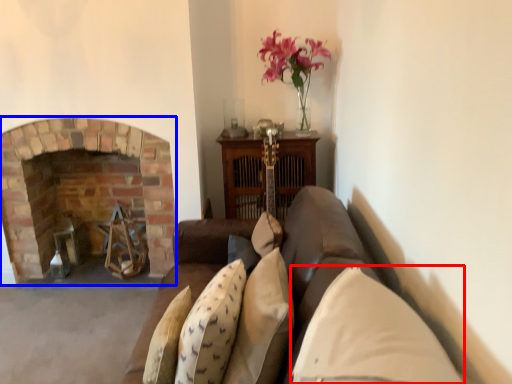
Question: Among these objects, which one is nearest to the camera, pillow (highlighted by a red box) or fireplace (highlighted by a blue box)?

Choices:
 (A) pillow
 (B) fireplace

Answer: (A)